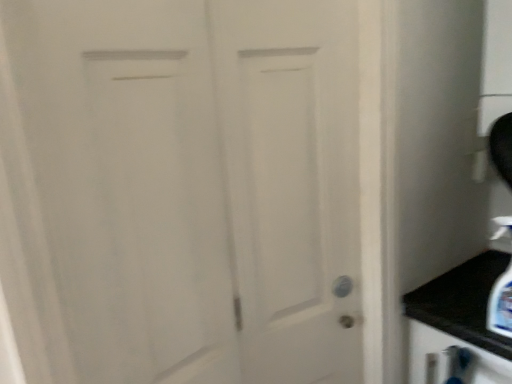
Question: Would you say white matte door at center is to the left or to the right of clear plastic soap dispenser at lower right in the picture?

Choices:
 (A) right
 (B) left

Answer: (B)

Question: Considering the positions of point (340, 115) and point (495, 299), is point (340, 115) closer or farther from the camera than point (495, 299)?

Choices:
 (A) farther
 (B) closer

Answer: (B)

Question: Based on their sizes in the image, would you say white matte door at center is bigger or smaller than clear plastic soap dispenser at lower right?

Choices:
 (A) big
 (B) small

Answer: (A)

Question: Is clear plastic soap dispenser at lower right in front of or behind white matte door at center in the image?

Choices:
 (A) behind
 (B) front

Answer: (A)

Question: Visually, is clear plastic soap dispenser at lower right positioned to the left or to the right of white matte door at center?

Choices:
 (A) left
 (B) right

Answer: (B)

Question: Choose the correct answer: Is clear plastic soap dispenser at lower right inside white matte door at center or outside it?

Choices:
 (A) inside
 (B) outside

Answer: (B)

Question: Considering the positions of clear plastic soap dispenser at lower right and white matte door at center in the image, is clear plastic soap dispenser at lower right bigger or smaller than white matte door at center?

Choices:
 (A) big
 (B) small

Answer: (B)